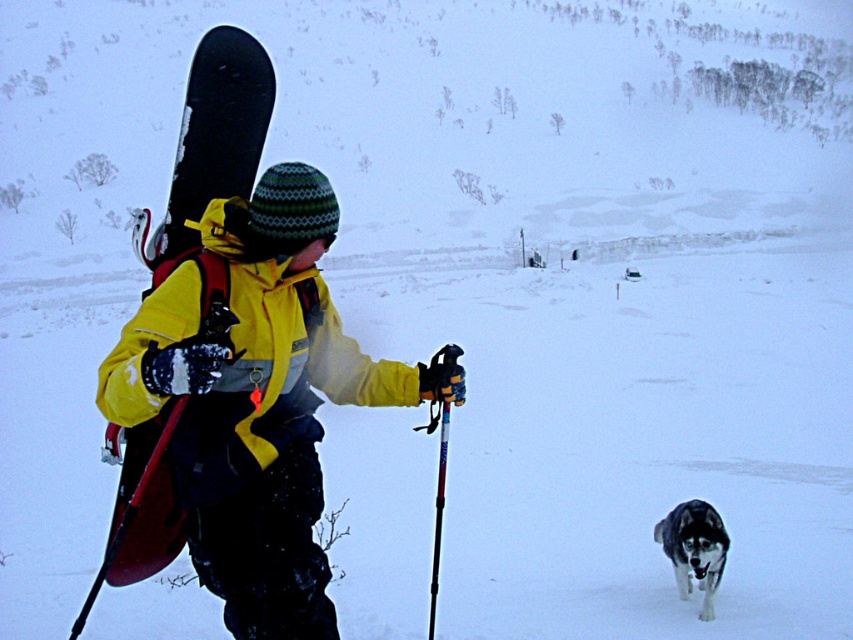
You are a photographer trying to capture the person in the yellow matte jacket at center and the matte black snowboard at left. Which object should you focus on first if you want to ensure both are in frame without moving the camera?

The yellow matte jacket at center is not as tall as the matte black snowboard at left, so you should focus on the matte black snowboard at left first since it is taller and will require more vertical space in the frame.